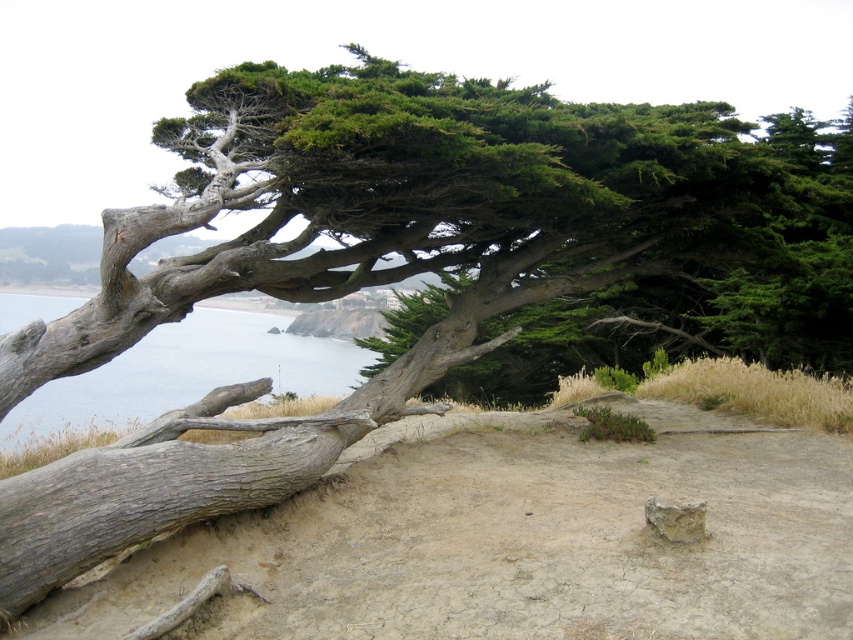
Question: Can you confirm if dull brown dirt at center is positioned below blue water at left?

Choices:
 (A) yes
 (B) no

Answer: (A)

Question: Is dull brown dirt at center positioned in front of blue water at left?

Choices:
 (A) yes
 (B) no

Answer: (A)

Question: Which of the following is the closest to the observer?

Choices:
 (A) (26, 404)
 (B) (633, 589)

Answer: (B)

Question: Where is dull brown dirt at center located in relation to blue water at left in the image?

Choices:
 (A) above
 (B) below

Answer: (B)